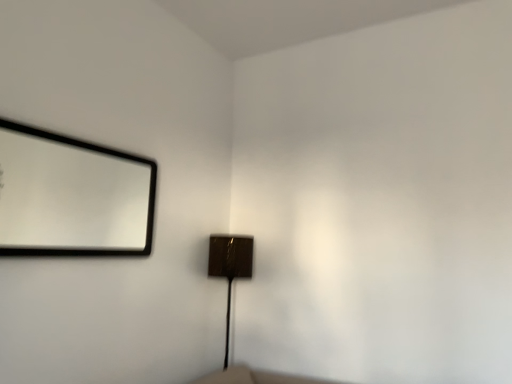
What do you see at coordinates (70, 196) in the screenshot? I see `matte black mirror at upper left` at bounding box center [70, 196].

Find the location of a particular element. The image size is (512, 384). matte black mirror at upper left is located at coordinates (70, 196).

The image size is (512, 384). Describe the element at coordinates (230, 267) in the screenshot. I see `shiny brown lamp at center` at that location.

Locate an element on the screen. Image resolution: width=512 pixels, height=384 pixels. shiny brown lamp at center is located at coordinates (230, 267).

In order to face shiny brown lamp at center, should I rotate leftwards or rightwards?

Turn left approximately 3.226 degrees to face it.

You are a GUI agent. You are given a task and a screenshot of the screen. Output one action in this format:
    pyautogui.click(x=<x>, y=<y>)
    Task: Click on the matte black mirror at upper left
    The height and width of the screenshot is (384, 512).
    Given the screenshot: What is the action you would take?
    pyautogui.click(x=70, y=196)

Is matte black mirror at upper left at the right side of shiny brown lamp at center?

Incorrect, matte black mirror at upper left is not on the right side of shiny brown lamp at center.

Between matte black mirror at upper left and shiny brown lamp at center, which one is positioned in front?

matte black mirror at upper left is in front.

Is point (10, 131) closer to camera compared to point (247, 277)?

Yes, it is in front of point (247, 277).

From the image's perspective, is matte black mirror at upper left over shiny brown lamp at center?

Answer: Yes, from the image's perspective, matte black mirror at upper left is above shiny brown lamp at center.

From a real-world perspective, is matte black mirror at upper left under shiny brown lamp at center?

No, from a real-world perspective, matte black mirror at upper left is not under shiny brown lamp at center.

Considering the relative sizes of matte black mirror at upper left and shiny brown lamp at center in the image provided, is matte black mirror at upper left wider than shiny brown lamp at center?

In fact, matte black mirror at upper left might be narrower than shiny brown lamp at center.

Considering the sizes of objects matte black mirror at upper left and shiny brown lamp at center in the image provided, who is shorter, matte black mirror at upper left or shiny brown lamp at center?

matte black mirror at upper left is shorter.

Can you confirm if matte black mirror at upper left is smaller than shiny brown lamp at center?

Correct, matte black mirror at upper left occupies less space than shiny brown lamp at center.

Is shiny brown lamp at center completely or partially inside matte black mirror at upper left?

No, shiny brown lamp at center is not a part of matte black mirror at upper left.

Is matte black mirror at upper left not near shiny brown lamp at center?

That's right, there is a large distance between matte black mirror at upper left and shiny brown lamp at center.

Could you tell me if matte black mirror at upper left is facing shiny brown lamp at center?

No, matte black mirror at upper left does not turn towards shiny brown lamp at center.

Where is `lamp that is under the matte black mirror at upper left (from a real-world perspective)`? This screenshot has width=512, height=384. lamp that is under the matte black mirror at upper left (from a real-world perspective) is located at coordinates (230, 267).

Based on the photo, is shiny brown lamp at center at the right side of matte black mirror at upper left?

Correct, you'll find shiny brown lamp at center to the right of matte black mirror at upper left.

Which is behind, shiny brown lamp at center or matte black mirror at upper left?

shiny brown lamp at center is more distant.

Is point (226, 327) in front of point (89, 168)?

That is True.

Based on the photo, from the image's perspective, is shiny brown lamp at center over matte black mirror at upper left?

No, from the image's perspective, shiny brown lamp at center is not above matte black mirror at upper left.

From a real-world perspective, which is physically above, shiny brown lamp at center or matte black mirror at upper left?

matte black mirror at upper left.

Which object is wider, shiny brown lamp at center or matte black mirror at upper left?

shiny brown lamp at center is wider.

Considering the relative sizes of shiny brown lamp at center and matte black mirror at upper left in the image provided, is shiny brown lamp at center shorter than matte black mirror at upper left?

Incorrect, the height of shiny brown lamp at center does not fall short of that of matte black mirror at upper left.

Based on the photo, considering the relative sizes of shiny brown lamp at center and matte black mirror at upper left in the image provided, is shiny brown lamp at center smaller than matte black mirror at upper left?

Actually, shiny brown lamp at center might be larger than matte black mirror at upper left.

Choose the correct answer: Is shiny brown lamp at center inside matte black mirror at upper left or outside it?

shiny brown lamp at center cannot be found inside matte black mirror at upper left.

Is shiny brown lamp at center directly adjacent to matte black mirror at upper left?

There is a gap between shiny brown lamp at center and matte black mirror at upper left.

Is matte black mirror at upper left at the back of shiny brown lamp at center?

No, shiny brown lamp at center's orientation is not away from matte black mirror at upper left.

Consider the image. How far apart are shiny brown lamp at center and matte black mirror at upper left?

The distance of shiny brown lamp at center from matte black mirror at upper left is 1.53 meters.

This screenshot has width=512, height=384. I want to click on mirror above the shiny brown lamp at center (from the image's perspective), so click(x=70, y=196).

At what (x,y) coordinates should I click in order to perform the action: click on mirror above the shiny brown lamp at center (from a real-world perspective). Please return your answer as a coordinate pair (x, y). Looking at the image, I should click on (70, 196).

Find the location of a particular element. mirror to the left of shiny brown lamp at center is located at coordinates (70, 196).